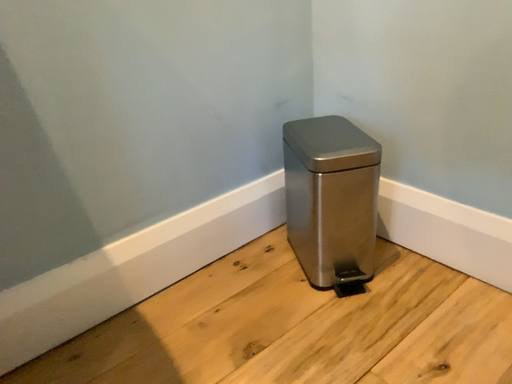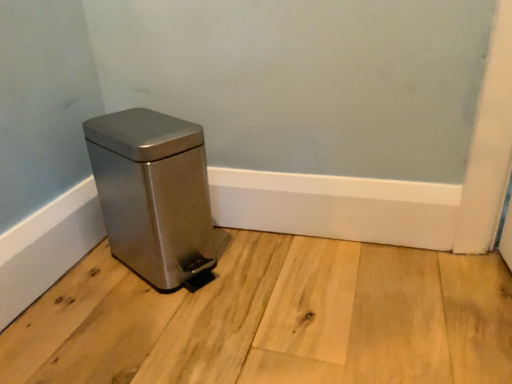
Question: How did the camera likely rotate when shooting the video?

Choices:
 (A) rotated downward
 (B) rotated upward

Answer: (B)